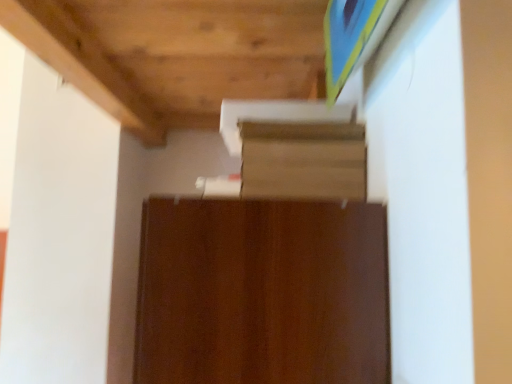
This screenshot has width=512, height=384. I want to click on wooden shelf at upper center, so pyautogui.click(x=303, y=161).

This screenshot has height=384, width=512. Describe the element at coordinates (303, 161) in the screenshot. I see `wooden shelf at upper center` at that location.

What is the approximate height of brown wood cabinet at center?

The height of brown wood cabinet at center is 32.06 inches.

The image size is (512, 384). What do you see at coordinates (262, 293) in the screenshot?
I see `brown wood cabinet at center` at bounding box center [262, 293].

Where is `brown wood cabinet at center`? This screenshot has height=384, width=512. brown wood cabinet at center is located at coordinates (262, 293).

This screenshot has height=384, width=512. What are the coordinates of `wooden shelf at upper center` in the screenshot? It's located at (303, 161).

Between wooden shelf at upper center and brown wood cabinet at center, which one appears on the right side from the viewer's perspective?

wooden shelf at upper center is more to the right.

From the picture: Is wooden shelf at upper center closer to camera compared to brown wood cabinet at center?

No, it is not.

Considering the positions of points (256, 128) and (362, 280), is point (256, 128) closer to camera compared to point (362, 280)?

No, (256, 128) is behind (362, 280).

From the image's perspective, relative to brown wood cabinet at center, is wooden shelf at upper center above or below?

wooden shelf at upper center is situated higher than brown wood cabinet at center in the image.

From a real-world perspective, is wooden shelf at upper center on brown wood cabinet at center?

Yes.

Looking at their sizes, would you say wooden shelf at upper center is wider or thinner than brown wood cabinet at center?

wooden shelf at upper center is thinner than brown wood cabinet at center.

Can you confirm if wooden shelf at upper center is shorter than brown wood cabinet at center?

Yes.

Who is bigger, wooden shelf at upper center or brown wood cabinet at center?

brown wood cabinet at center is bigger.

Is wooden shelf at upper center outside of brown wood cabinet at center?

Yes.

Are wooden shelf at upper center and brown wood cabinet at center making contact?

No, wooden shelf at upper center is not with brown wood cabinet at center.

Is wooden shelf at upper center turned away from brown wood cabinet at center?

No.

In order to click on shelf that is above the brown wood cabinet at center (from the image's perspective) in this screenshot , I will do `click(303, 161)`.

Is brown wood cabinet at center at the right side of wooden shelf at upper center?

No.

Looking at this image, considering the positions of objects brown wood cabinet at center and wooden shelf at upper center in the image provided, who is behind, brown wood cabinet at center or wooden shelf at upper center?

wooden shelf at upper center is more distant.

Which is nearer, (151,240) or (283,193)?

Point (151,240) is closer to the camera than point (283,193).

From the image's perspective, does brown wood cabinet at center appear higher than wooden shelf at upper center?

No, from the image's perspective, brown wood cabinet at center is not above wooden shelf at upper center.

From a real-world perspective, is brown wood cabinet at center located beneath wooden shelf at upper center?

Indeed, from a real-world perspective, brown wood cabinet at center is positioned beneath wooden shelf at upper center.

Between brown wood cabinet at center and wooden shelf at upper center, which one has smaller width?

wooden shelf at upper center.

Is brown wood cabinet at center shorter than wooden shelf at upper center?

In fact, brown wood cabinet at center may be taller than wooden shelf at upper center.

Can you confirm if brown wood cabinet at center is bigger than wooden shelf at upper center?

Correct, brown wood cabinet at center is larger in size than wooden shelf at upper center.

Would you say brown wood cabinet at center is outside wooden shelf at upper center?

brown wood cabinet at center is positioned outside wooden shelf at upper center.

Are brown wood cabinet at center and wooden shelf at upper center far apart?

They are positioned close to each other.

Is brown wood cabinet at center turned away from wooden shelf at upper center?

No, wooden shelf at upper center is not at the back of brown wood cabinet at center.

What's the angular difference between brown wood cabinet at center and wooden shelf at upper center's facing directions?

0.000104 degrees separate the facing orientations of brown wood cabinet at center and wooden shelf at upper center.

In order to click on cabinetry in front of the wooden shelf at upper center in this screenshot , I will do `click(262, 293)`.

I want to click on shelf behind the brown wood cabinet at center, so (x=303, y=161).

Find the location of a particular element. The height and width of the screenshot is (384, 512). cabinetry in front of the wooden shelf at upper center is located at coordinates (262, 293).